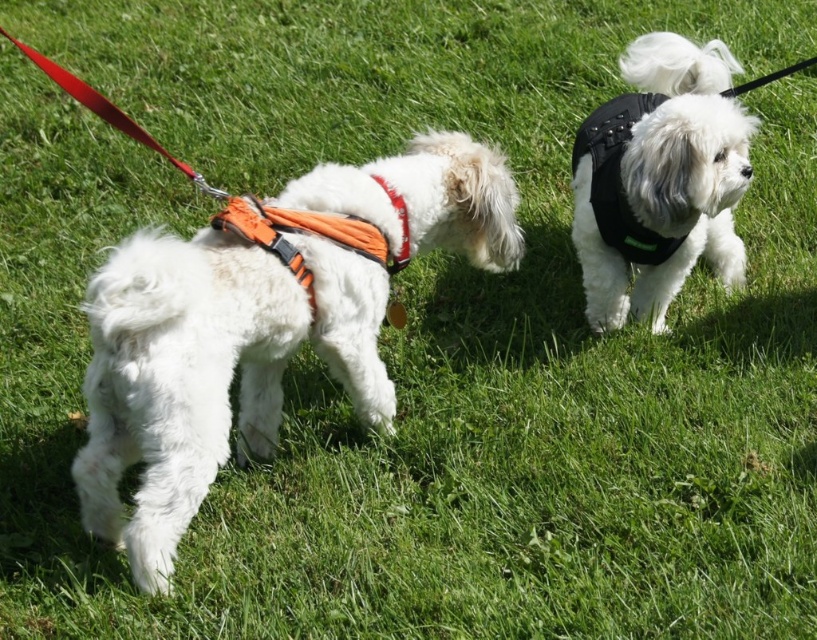
You are standing at the origin point of the coordinate system. You want to walk towards the white soft fur dog at left. Which direction should you move in the x and y axes? Please provide the direction in terms of positive or negative direction along each axis.

To reach the white soft fur dog at left located at coordinate point 0.580 on the x axis and 0.256 on the y axis, you should move in the positive x direction and positive y direction from the origin.

You are a photographer trying to capture both dogs in a single shot. You notice two specific points in the image labeled as point (x=362, y=392) and point (x=699, y=147). Which point should you focus on to ensure the dog closer to the camera is in sharp focus?

Point (x=362, y=392) should be focused on because it is further to the camera than point (x=699, y=147), meaning the dog at that point is closer and will be in focus.

You are a dog trainer observing two dogs in a park. You notice the white soft fur dog at left and the orange fabric neckband at center. Which dog has a taller height?

The white soft fur dog at left is much taller than the orange fabric neckband at center.